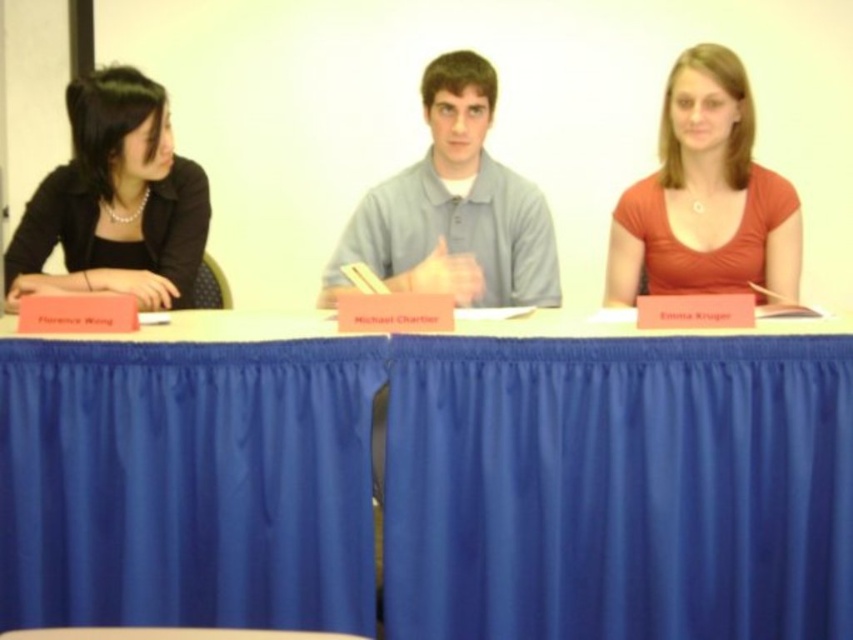
Question: In this image, where is blue fabric table at center located relative to matte orange shirt at right?

Choices:
 (A) left
 (B) right

Answer: (A)

Question: Which object appears farthest from the camera in this image?

Choices:
 (A) matte orange shirt at right
 (B) gray cotton shirt at center
 (C) black matte blazer at left
 (D) blue fabric table at center

Answer: (B)

Question: In this image, where is black matte blazer at left located relative to matte orange shirt at right?

Choices:
 (A) below
 (B) above

Answer: (A)

Question: Can you confirm if blue fabric table at center is positioned to the right of gray cotton shirt at center?

Choices:
 (A) no
 (B) yes

Answer: (A)

Question: Which point appears farthest from the camera in this image?

Choices:
 (A) (477, 170)
 (B) (136, 280)

Answer: (A)

Question: Which point is farther from the camera taking this photo?

Choices:
 (A) (711, 211)
 (B) (500, 246)
 (C) (822, 346)

Answer: (B)